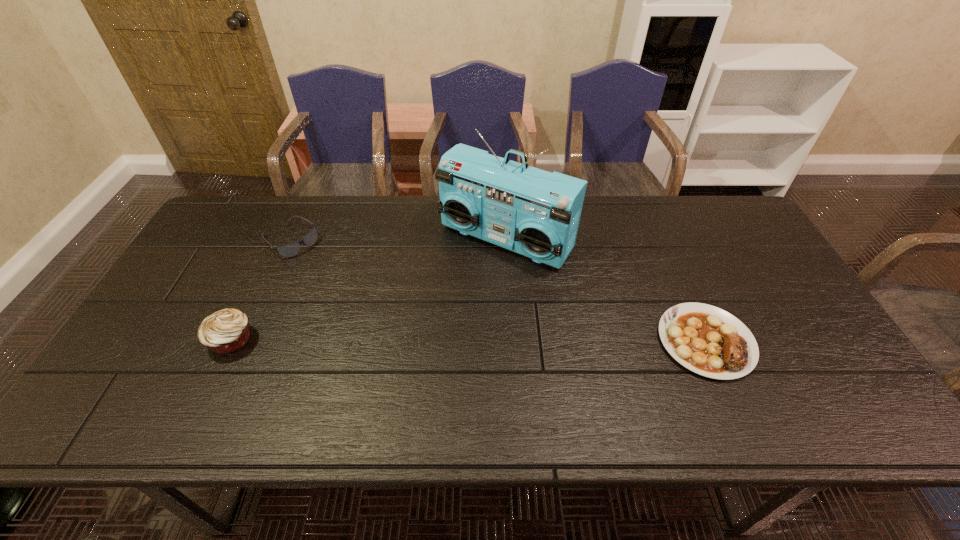
Where is `vacant space on the desktop that is between the second tallest object and the steak and is positioned on the front-facing side of the radio receiver`? The height and width of the screenshot is (540, 960). vacant space on the desktop that is between the second tallest object and the steak and is positioned on the front-facing side of the radio receiver is located at coordinates (422, 340).

This screenshot has height=540, width=960. Identify the location of vacant spot on the desktop that is between the second tallest object and the steak and is positioned on the lenses of the sunglasses. (420, 340).